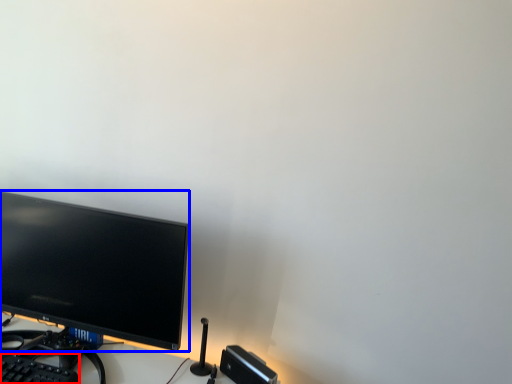
Question: Among these objects, which one is nearest to the camera, computer keyboard (highlighted by a red box) or computer monitor (highlighted by a blue box)?

Choices:
 (A) computer keyboard
 (B) computer monitor

Answer: (A)